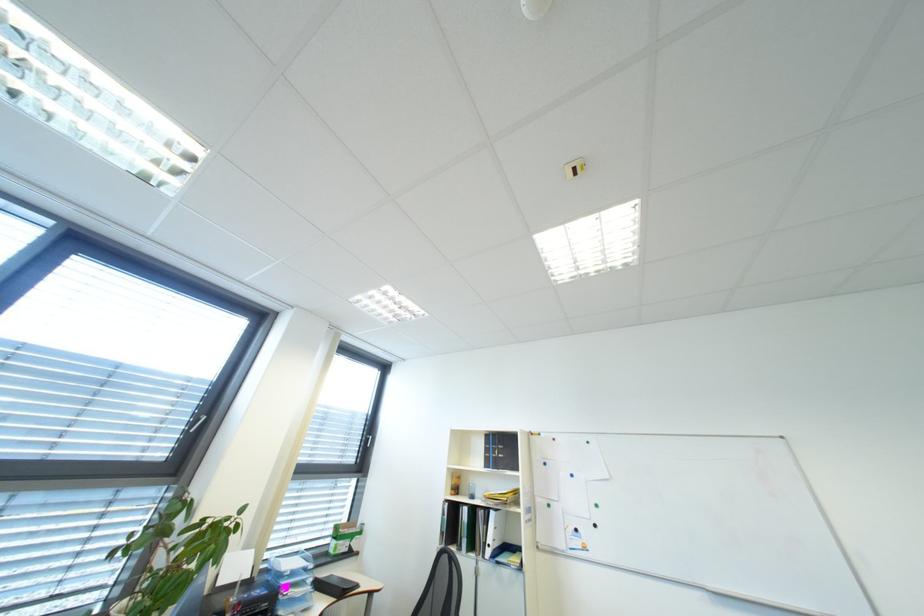
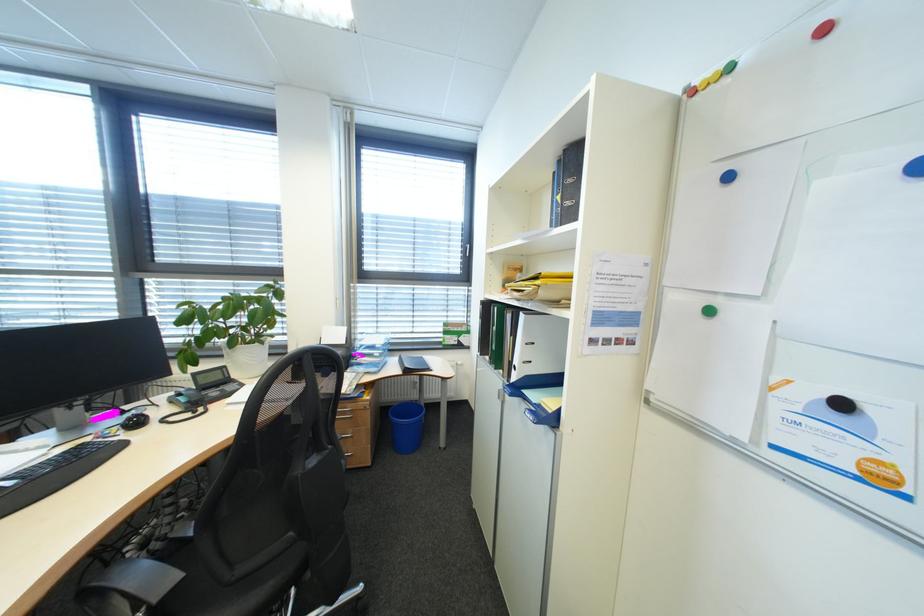
In the second image, find the point that corresponds to point (587, 532) in the first image.

(854, 406)